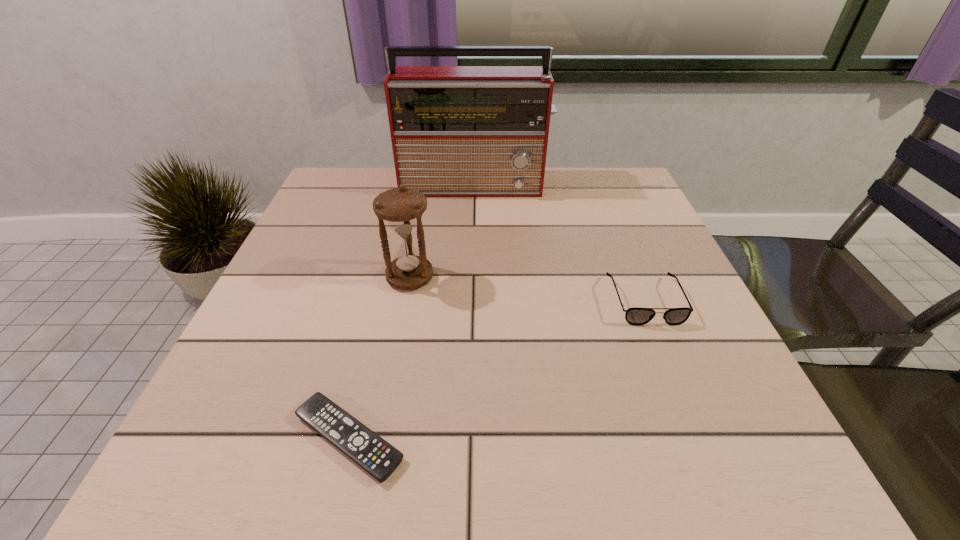
You are a GUI agent. You are given a task and a screenshot of the screen. Output one action in this format:
    pyautogui.click(x=<x>, y=<y>)
    Task: Click on the farthest object
    Image resolution: width=960 pixels, height=540 pixels.
    Given the screenshot: What is the action you would take?
    (457, 131)

You are a GUI agent. You are given a task and a screenshot of the screen. Output one action in this format:
    pyautogui.click(x=<x>, y=<y>)
    Task: Click on the radio receiver
    The height and width of the screenshot is (540, 960).
    Given the screenshot: What is the action you would take?
    coord(457,131)

The image size is (960, 540). I want to click on hourglass, so click(x=402, y=208).

You are a GUI agent. You are given a task and a screenshot of the screen. Output one action in this format:
    pyautogui.click(x=<x>, y=<y>)
    Task: Click on the rightmost object
    This screenshot has height=540, width=960.
    Given the screenshot: What is the action you would take?
    pyautogui.click(x=638, y=316)

Where is `the second shortest object`? The image size is (960, 540). the second shortest object is located at coordinates (638, 316).

Find the location of a particular element. remote control is located at coordinates (376, 456).

This screenshot has width=960, height=540. Find the location of `the nearest object`. the nearest object is located at coordinates (x=376, y=456).

What are the coordinates of `vacant area situated on the front-facing side of the tallest object` in the screenshot? It's located at [473, 279].

Locate an element on the screen. The image size is (960, 540). free spot located on the front of the hourglass is located at coordinates (379, 446).

At what (x,y) coordinates should I click in order to perform the action: click on vacant space situated on the front-facing side of the rightmost object. Please return your answer as a coordinate pair (x, y). The width and height of the screenshot is (960, 540). Looking at the image, I should click on (688, 405).